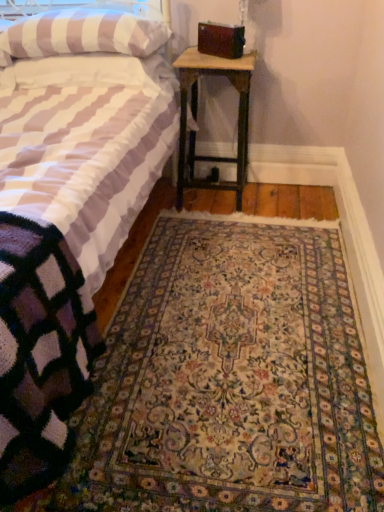
Question: Is carpeted rug at center facing away from wooden nightstand at lower right?

Choices:
 (A) no
 (B) yes

Answer: (A)

Question: Is wooden nightstand at lower right located within carpeted rug at center?

Choices:
 (A) no
 (B) yes

Answer: (A)

Question: Can you see carpeted rug at center touching wooden nightstand at lower right?

Choices:
 (A) no
 (B) yes

Answer: (A)

Question: Does carpeted rug at center have a larger size compared to wooden nightstand at lower right?

Choices:
 (A) no
 (B) yes

Answer: (B)

Question: Is carpeted rug at center positioned beyond the bounds of wooden nightstand at lower right?

Choices:
 (A) no
 (B) yes

Answer: (B)

Question: Does carpeted rug at center have a lesser height compared to wooden nightstand at lower right?

Choices:
 (A) yes
 (B) no

Answer: (A)

Question: Is wooden nightstand at lower right not inside striped fabric pillow at upper left?

Choices:
 (A) yes
 (B) no

Answer: (A)

Question: Is wooden nightstand at lower right shorter than striped fabric pillow at upper left?

Choices:
 (A) yes
 (B) no

Answer: (B)

Question: From the image's perspective, would you say wooden nightstand at lower right is positioned over striped fabric pillow at upper left?

Choices:
 (A) yes
 (B) no

Answer: (B)

Question: Is wooden nightstand at lower right positioned behind striped fabric pillow at upper left?

Choices:
 (A) no
 (B) yes

Answer: (B)

Question: Considering the relative sizes of wooden nightstand at lower right and striped fabric pillow at upper left in the image provided, is wooden nightstand at lower right bigger than striped fabric pillow at upper left?

Choices:
 (A) no
 (B) yes

Answer: (B)

Question: Does wooden nightstand at lower right have a greater height compared to striped fabric pillow at upper left?

Choices:
 (A) no
 (B) yes

Answer: (B)

Question: Are carpeted rug at center and striped fabric pillow at upper left far apart?

Choices:
 (A) yes
 (B) no

Answer: (A)